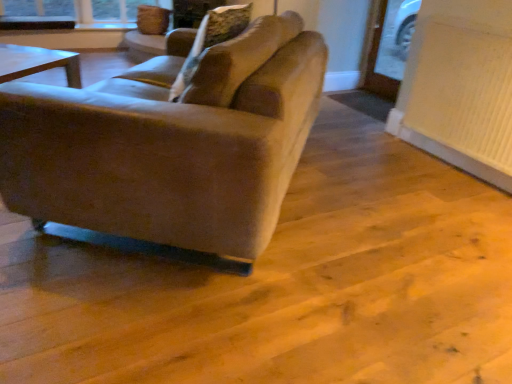
Question: Does suede-like beige couch at center appear on the right side of white textured radiator at lower right?

Choices:
 (A) yes
 (B) no

Answer: (B)

Question: Considering the relative sizes of suede-like beige couch at center and white textured radiator at lower right in the image provided, is suede-like beige couch at center taller than white textured radiator at lower right?

Choices:
 (A) no
 (B) yes

Answer: (A)

Question: Is suede-like beige couch at center at the left side of white textured radiator at lower right?

Choices:
 (A) yes
 (B) no

Answer: (A)

Question: Does suede-like beige couch at center have a larger size compared to white textured radiator at lower right?

Choices:
 (A) no
 (B) yes

Answer: (B)

Question: Is the depth of suede-like beige couch at center greater than that of white textured radiator at lower right?

Choices:
 (A) no
 (B) yes

Answer: (A)

Question: Is white textured radiator at lower right spatially inside suede-like beige pillow at center, or outside of it?

Choices:
 (A) outside
 (B) inside

Answer: (A)

Question: Is white textured radiator at lower right taller or shorter than suede-like beige pillow at center?

Choices:
 (A) tall
 (B) short

Answer: (A)

Question: Is white textured radiator at lower right bigger or smaller than suede-like beige pillow at center?

Choices:
 (A) big
 (B) small

Answer: (B)

Question: Considering the positions of point (472, 152) and point (236, 11), is point (472, 152) closer or farther from the camera than point (236, 11)?

Choices:
 (A) farther
 (B) closer

Answer: (A)

Question: From a real-world perspective, is suede-like beige pillow at center above or below suede-like beige couch at center?

Choices:
 (A) above
 (B) below

Answer: (A)

Question: Considering the positions of suede-like beige pillow at center and suede-like beige couch at center in the image, is suede-like beige pillow at center taller or shorter than suede-like beige couch at center?

Choices:
 (A) short
 (B) tall

Answer: (A)

Question: Which is correct: suede-like beige pillow at center is inside suede-like beige couch at center, or outside of it?

Choices:
 (A) outside
 (B) inside

Answer: (B)

Question: Looking at their shapes, would you say suede-like beige pillow at center is wider or thinner than suede-like beige couch at center?

Choices:
 (A) thin
 (B) wide

Answer: (A)

Question: From a real-world perspective, is suede-like beige pillow at center positioned above or below white textured radiator at lower right?

Choices:
 (A) above
 (B) below

Answer: (A)

Question: Is point (203, 29) positioned closer to the camera than point (487, 49)?

Choices:
 (A) farther
 (B) closer

Answer: (B)